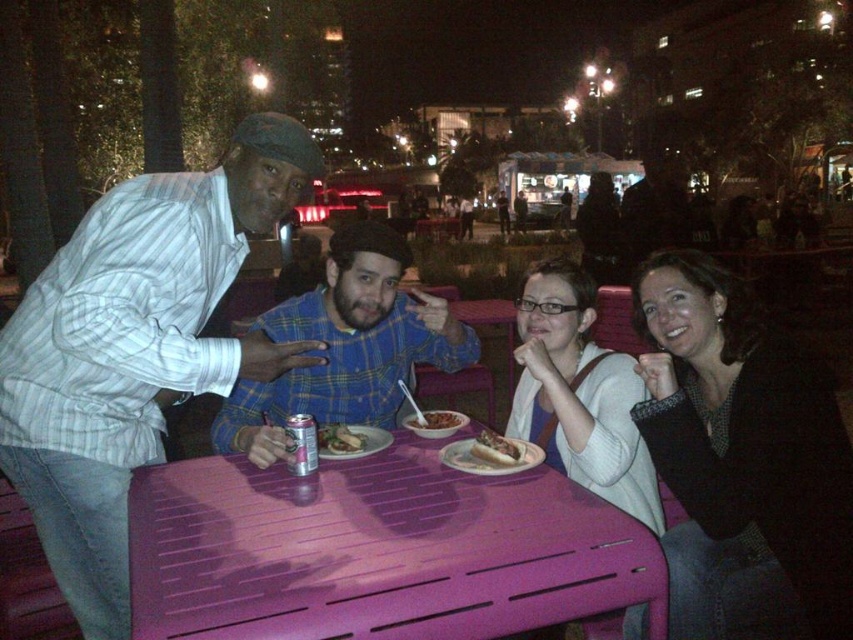
Who is lower down, purple plastic table at center or shiny metallic can at table center?

purple plastic table at center is lower down.

Which is above, purple plastic table at center or shiny metallic can at table center?

Positioned higher is shiny metallic can at table center.

This screenshot has height=640, width=853. Find the location of `purple plastic table at center`. purple plastic table at center is located at coordinates (376, 550).

Does shiny white hot dog at center have a larger size compared to shiny metallic can at table center?

Indeed, shiny white hot dog at center has a larger size compared to shiny metallic can at table center.

Is point (491, 436) behind point (321, 435)?

No.

Where is `shiny white hot dog at center`? shiny white hot dog at center is located at coordinates (496, 449).

Who is more distant from viewer, (169,275) or (453,413)?

The point (453,413) is behind.

Does striped cotton shirt at left appear over smooth brown rice bowl at center?

Yes.

Between point (244, 244) and point (430, 420), which one is positioned in front?

Point (244, 244) is more forward.

The image size is (853, 640). I want to click on striped cotton shirt at left, so (x=135, y=348).